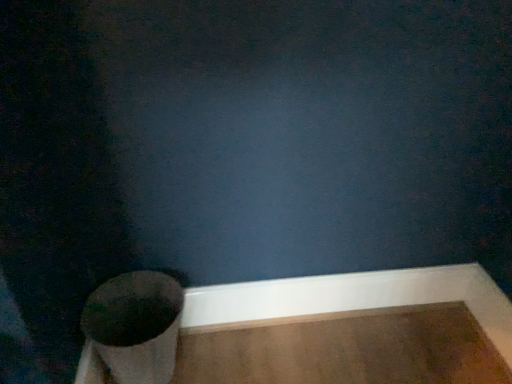
Question: Is point (325, 281) positioned closer to the camera than point (103, 311)?

Choices:
 (A) closer
 (B) farther

Answer: (B)

Question: From the image's perspective, is white smooth baseboard at lower right above or below matte black toilet at lower left?

Choices:
 (A) below
 (B) above

Answer: (B)

Question: In terms of width, does white smooth baseboard at lower right look wider or thinner when compared to matte black toilet at lower left?

Choices:
 (A) thin
 (B) wide

Answer: (A)

Question: Is matte black toilet at lower left wider or thinner than white smooth baseboard at lower right?

Choices:
 (A) thin
 (B) wide

Answer: (B)

Question: Is matte black toilet at lower left inside the boundaries of white smooth baseboard at lower right, or outside?

Choices:
 (A) inside
 (B) outside

Answer: (B)

Question: Relative to white smooth baseboard at lower right, is matte black toilet at lower left in front or behind?

Choices:
 (A) front
 (B) behind

Answer: (A)

Question: Is matte black toilet at lower left bigger or smaller than white smooth baseboard at lower right?

Choices:
 (A) big
 (B) small

Answer: (A)